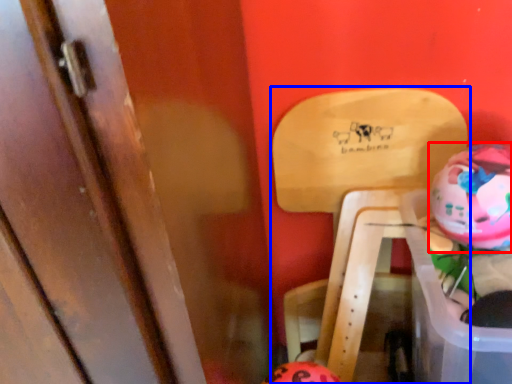
Question: Which of the following is the farthest to the observer, piggy bank (highlighted by a red box) or furniture (highlighted by a blue box)?

Choices:
 (A) piggy bank
 (B) furniture

Answer: (B)